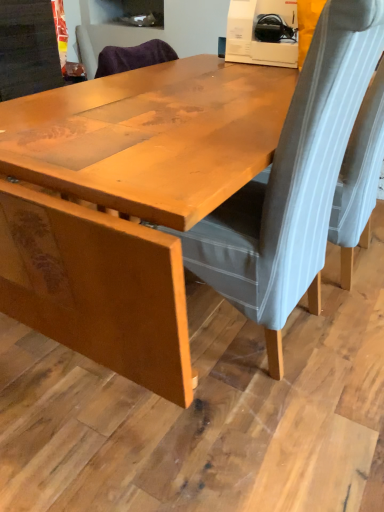
Question: Which direction should I rotate to look at velvet grey chair at center, the 1th chair in the left-to-right sequence, — up or down?

Choices:
 (A) down
 (B) up

Answer: (B)

Question: From a real-world perspective, is gray fabric chair at right, the second chair when ordered from left to right, on velvet grey chair at center, the second chair in the right-to-left sequence?

Choices:
 (A) no
 (B) yes

Answer: (A)

Question: Is gray fabric chair at right, the second chair when ordered from left to right, wider than velvet grey chair at center, the 1th chair in the left-to-right sequence?

Choices:
 (A) no
 (B) yes

Answer: (A)

Question: Is velvet grey chair at center, the second chair in the right-to-left sequence, completely or partially inside gray fabric chair at right, the 1th chair when ordered from right to left?

Choices:
 (A) yes
 (B) no

Answer: (B)

Question: From the image's perspective, would you say gray fabric chair at right, the 1th chair when ordered from right to left, is shown under velvet grey chair at center, the second chair in the right-to-left sequence?

Choices:
 (A) no
 (B) yes

Answer: (A)

Question: Is gray fabric chair at right, the second chair when ordered from left to right, outside of velvet grey chair at center, the second chair in the right-to-left sequence?

Choices:
 (A) no
 (B) yes

Answer: (B)

Question: Does gray fabric chair at right, the 1th chair when ordered from right to left, have a lesser height compared to velvet grey chair at center, the second chair in the right-to-left sequence?

Choices:
 (A) no
 (B) yes

Answer: (B)

Question: From the image's perspective, is velvet grey chair at center, the second chair in the right-to-left sequence, above wooden table at center?

Choices:
 (A) no
 (B) yes

Answer: (B)

Question: Does velvet grey chair at center, the 1th chair in the left-to-right sequence, have a lesser width compared to wooden table at center?

Choices:
 (A) yes
 (B) no

Answer: (A)

Question: From a real-world perspective, is velvet grey chair at center, the 1th chair in the left-to-right sequence, located beneath wooden table at center?

Choices:
 (A) no
 (B) yes

Answer: (A)

Question: Is velvet grey chair at center, the second chair in the right-to-left sequence, placed right next to wooden table at center?

Choices:
 (A) yes
 (B) no

Answer: (B)

Question: Is wooden table at center surrounded by velvet grey chair at center, the second chair in the right-to-left sequence?

Choices:
 (A) yes
 (B) no

Answer: (B)

Question: Can you confirm if velvet grey chair at center, the second chair in the right-to-left sequence, is smaller than wooden table at center?

Choices:
 (A) no
 (B) yes

Answer: (B)

Question: Is velvet grey chair at center, the second chair in the right-to-left sequence, far from gray fabric chair at right, the second chair when ordered from left to right?

Choices:
 (A) yes
 (B) no

Answer: (B)